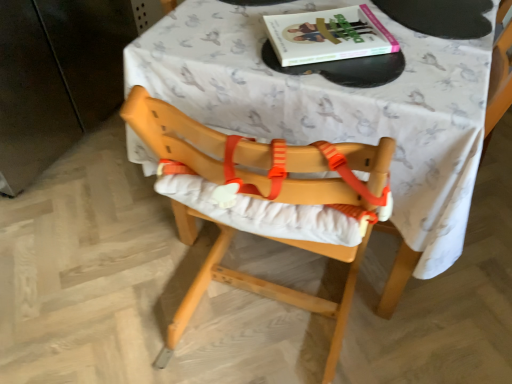
What are the coordinates of `vacant space underneath natural wood highchair at center (from a real-world perspective)` in the screenshot? It's located at (260, 333).